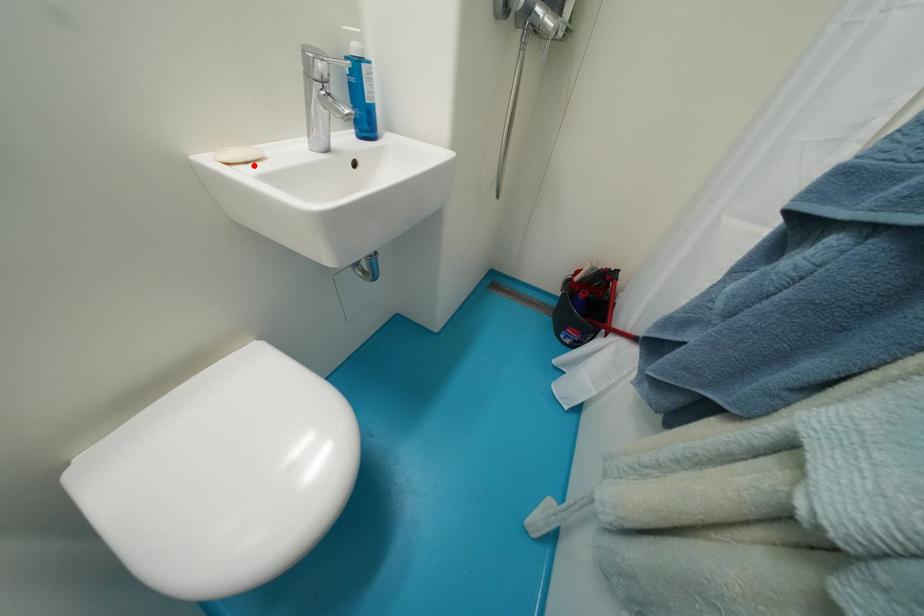
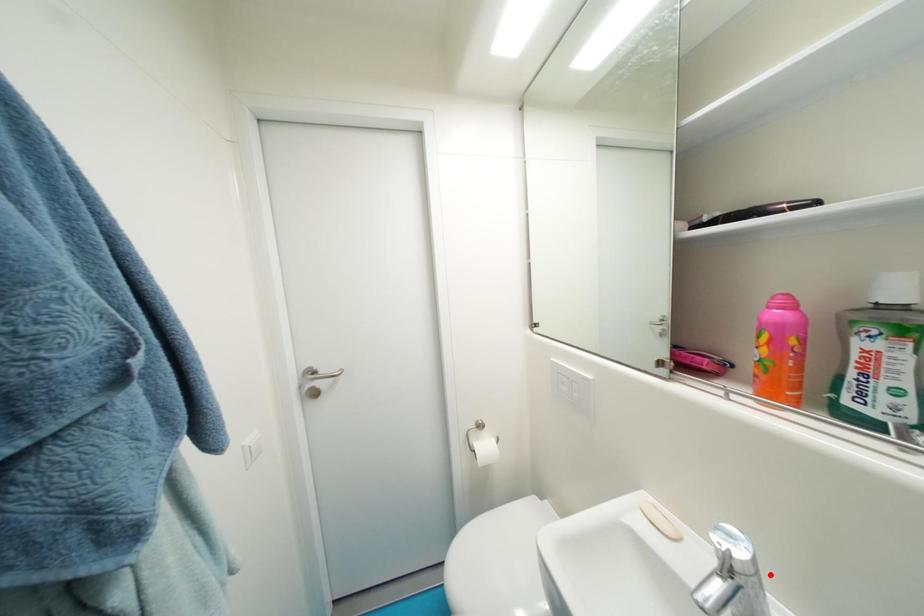
I am providing you with two images of the same scene from different viewpoints. A red point is marked on the first image and another point is marked on the second image. Do the highlighted points in image1 and image2 indicate the same real-world spot?

No